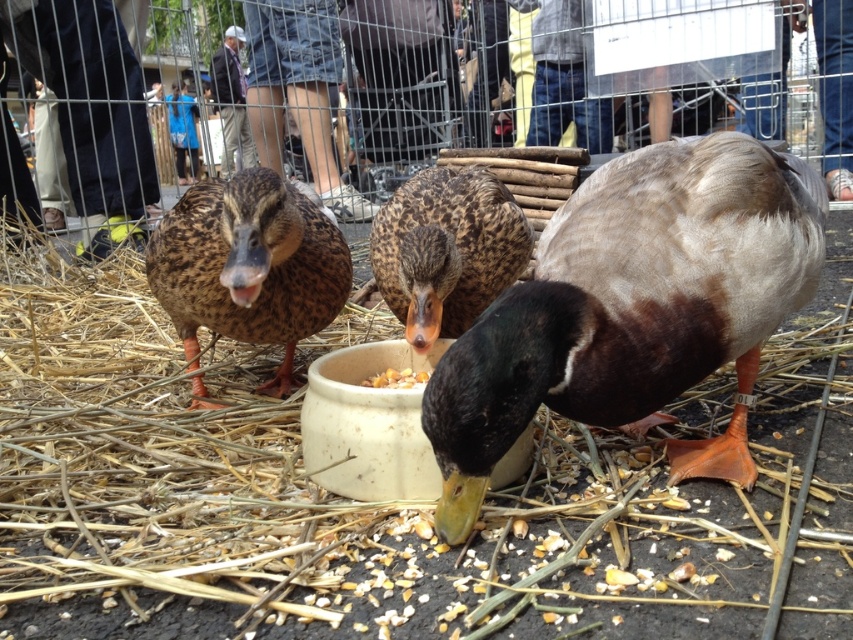
You are standing at the point labeled point (445, 250). Looking around, you see brown speckled feathers at center. Which direction should you move to reach the brown speckled feathers at center?

Since the point (445, 250) is already on the brown speckled feathers at center, you are already at the location of the brown speckled feathers at center.